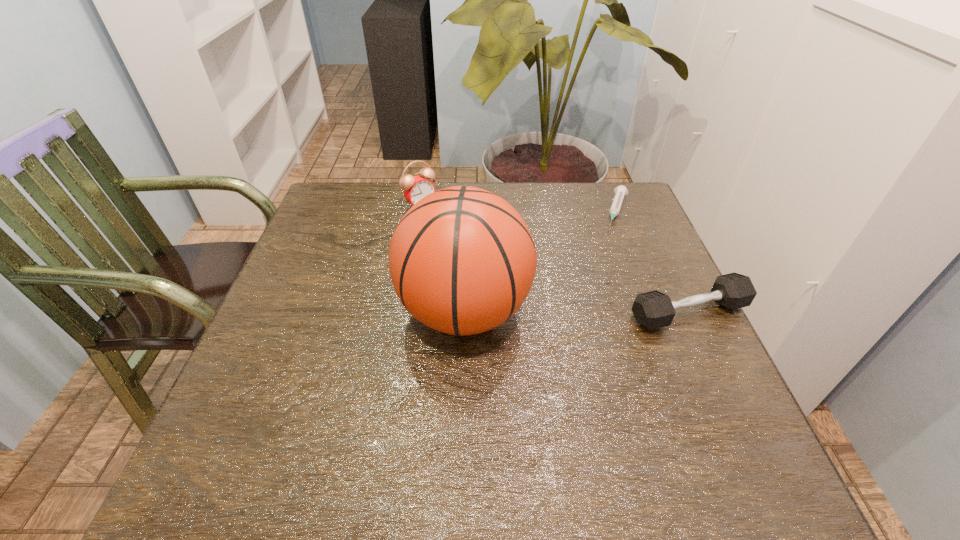
Locate an element on the screen. This screenshot has width=960, height=540. vacant area at the far left corner is located at coordinates (328, 218).

The height and width of the screenshot is (540, 960). In the image, there is a desktop. Find the location of `free space at the far right corner`. free space at the far right corner is located at coordinates (588, 206).

Where is `free point between the dumbbell and the tallest object`? The width and height of the screenshot is (960, 540). free point between the dumbbell and the tallest object is located at coordinates (577, 312).

Where is `unoccupied area between the syringe and the second tallest object`? The width and height of the screenshot is (960, 540). unoccupied area between the syringe and the second tallest object is located at coordinates (518, 207).

Find the location of `free space between the syringe and the second shortest object`. free space between the syringe and the second shortest object is located at coordinates (653, 261).

Locate an element on the screen. vacant region between the shortest object and the alarm clock is located at coordinates (518, 207).

Image resolution: width=960 pixels, height=540 pixels. I want to click on free space that is in between the alarm clock and the syringe, so click(x=518, y=207).

Find the location of a particular element. The image size is (960, 540). vacant space in between the shortest object and the dumbbell is located at coordinates (653, 261).

This screenshot has height=540, width=960. In order to click on free point between the shortest object and the second shortest object in this screenshot , I will do [x=653, y=261].

You are a GUI agent. You are given a task and a screenshot of the screen. Output one action in this format:
    pyautogui.click(x=<x>, y=<y>)
    Task: Click on the vacant space that's between the alarm clock and the syringe
    
    Given the screenshot: What is the action you would take?
    pyautogui.click(x=518, y=207)